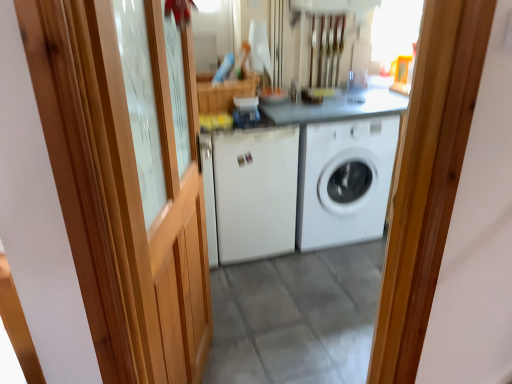
At what (x,y) coordinates should I click in order to perform the action: click on free spot behind wooden barn door at left. Please return your answer as a coordinate pair (x, y). Looking at the image, I should click on (243, 322).